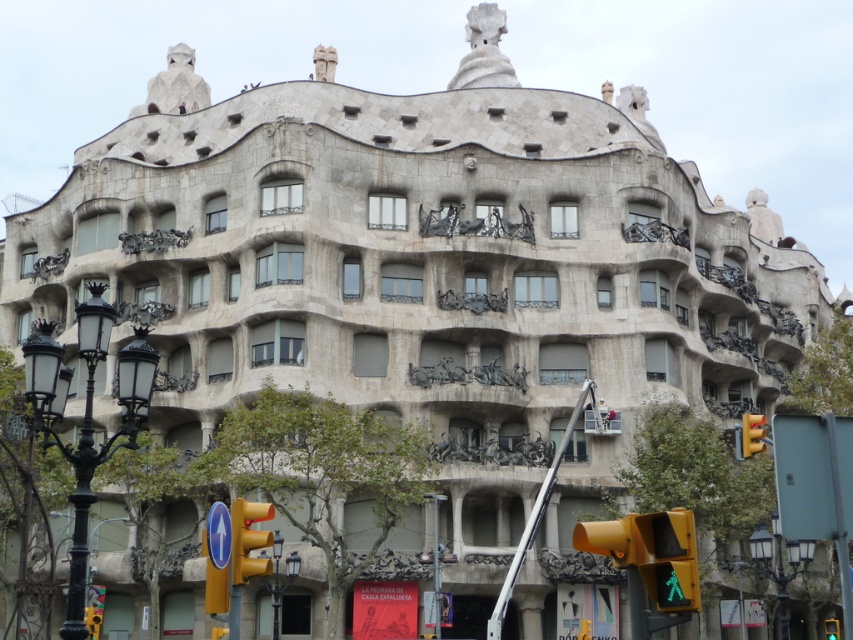
Question: Which object appears farthest from the camera in this image?

Choices:
 (A) yellow matte traffic light at lower right
 (B) yellow matte pedestrian signal at lower right
 (C) yellow matte traffic light at lower left
 (D) yellow plastic traffic light at lower left

Answer: (D)

Question: Which of the following is the closest to the observer?

Choices:
 (A) yellow matte traffic light at lower right
 (B) yellow plastic traffic light at lower left

Answer: (A)

Question: Does yellow matte pedestrian signal at lower right have a smaller size compared to yellow matte traffic light at lower left?

Choices:
 (A) no
 (B) yes

Answer: (B)

Question: Is yellow matte traffic light at lower right thinner than yellow plastic traffic light at lower left?

Choices:
 (A) no
 (B) yes

Answer: (A)

Question: In this image, where is yellow matte traffic light at lower right located relative to yellow plastic traffic light at lower right?

Choices:
 (A) below
 (B) above

Answer: (B)

Question: Which object appears farthest from the camera in this image?

Choices:
 (A) yellow matte pedestrian signal at lower right
 (B) yellow plastic traffic light at lower right
 (C) yellow plastic traffic light at lower left

Answer: (B)